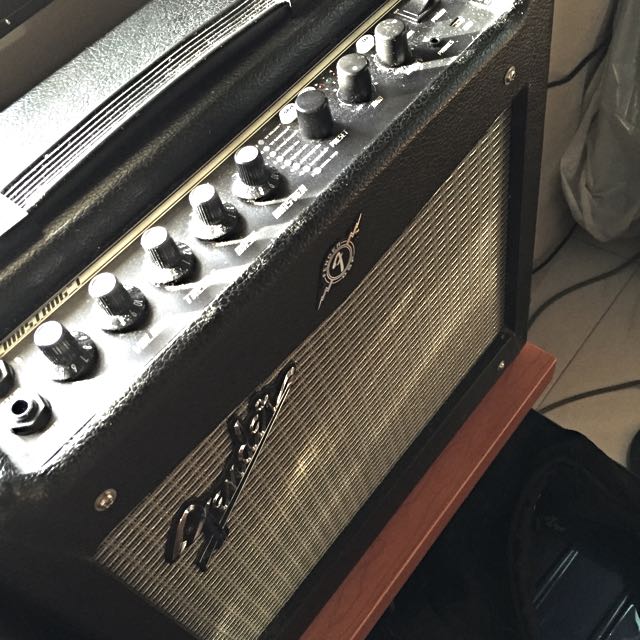
Locate an element on the screen. This screenshot has height=640, width=640. speaker is located at coordinates (152, 82), (348, 424).